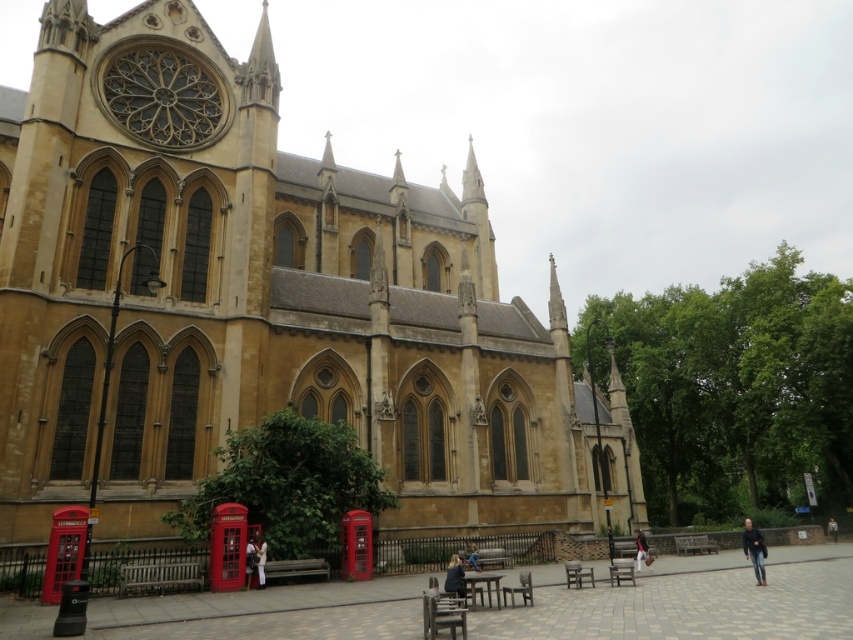
You are a photographer standing in front of the grand Gothic building. You notice two jackets hanging on a rack near the entrance. The jackets are the dark blue fabric jacket at center and the dark gray fabric jacket at lower right. Which jacket is narrower in width?

The dark blue fabric jacket at center is narrower in width than the dark gray fabric jacket at lower right.

You are a fashion designer observing a model wearing the dark blue fabric jacket at center and blue denim jeans at lower center. Which piece of clothing is higher on the model?

The dark blue fabric jacket at center is taller than the blue denim jeans at lower center, so the jacket is higher on the model.